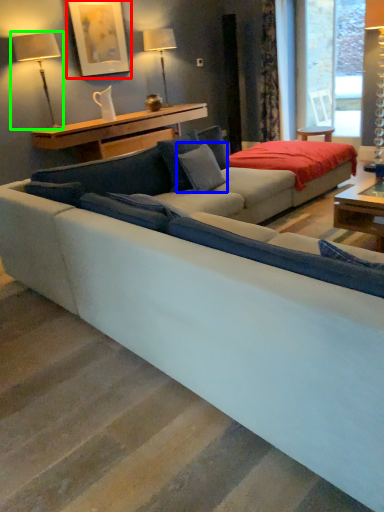
Question: Estimate the real-world distances between objects in this image. Which object is closer to picture frame (highlighted by a red box), pillow (highlighted by a blue box) or table lamp (highlighted by a green box)?

Choices:
 (A) pillow
 (B) table lamp

Answer: (B)